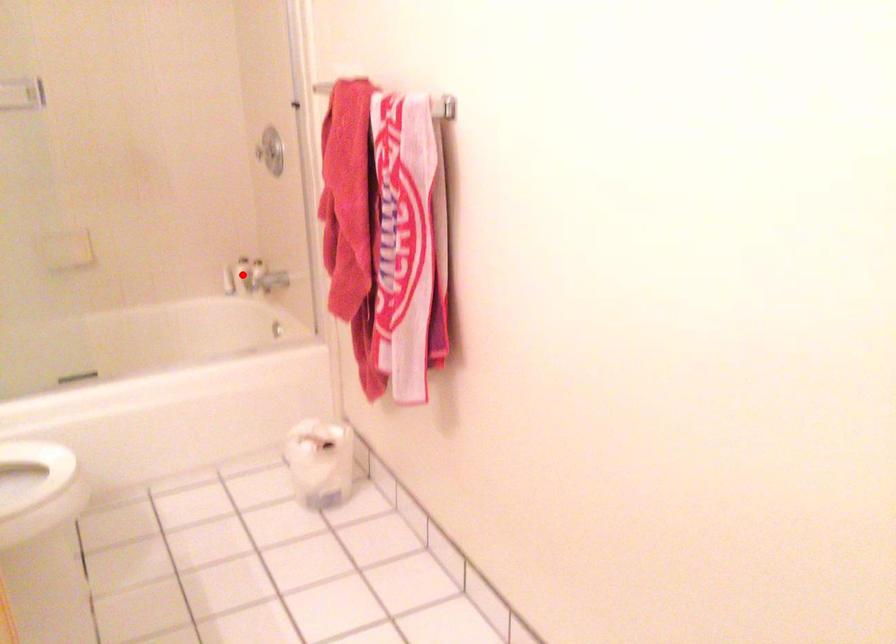
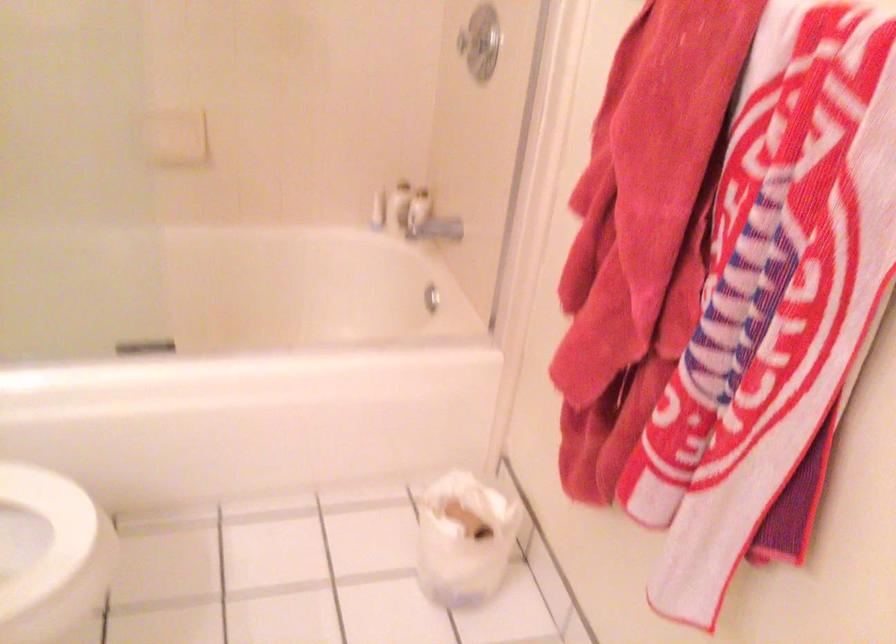
In the second image, find the point that corresponds to the highlighted location in the first image.

(399, 205)